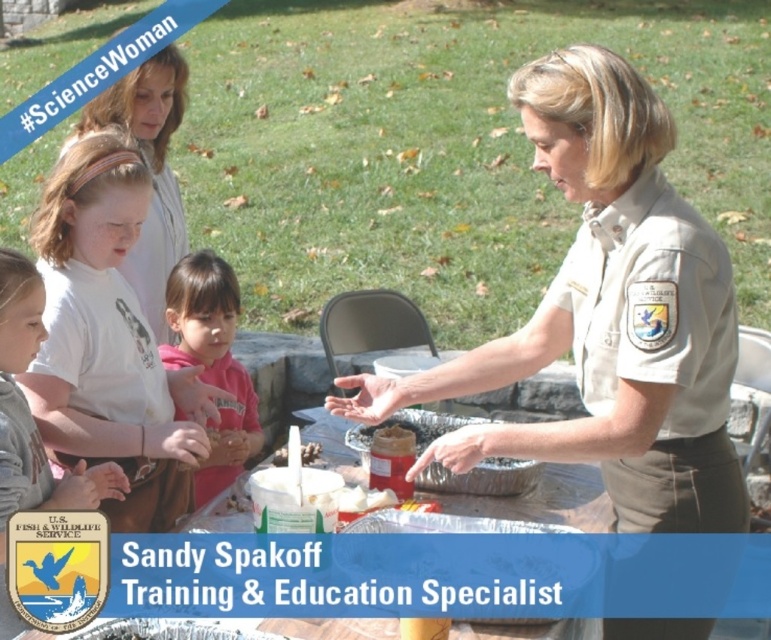
You are a photographer trying to capture a closeup of the two points in the image. From your current position, which point, point (628,131) or point (32,493), is nearer to you?

Point (628,131) is closer to the viewer than point (32,493), so the photographer should focus on that point first to capture it in a closeup.

Sandy Spakoff is demonstrating to a group of children. Which object is covering the other one, the satin tan uniform at center or the light brown hair at center?

The satin tan uniform at center is positioned over the light brown hair at center.

You are a photographer trying to capture a candid shot of the Training Specialist and the children. You notice two participants wearing a matte white shirt at lower left and a pink fleece hoodie at center. Which participant is positioned more to the left side of the scene?

The matte white shirt at lower left is positioned to the left of the pink fleece hoodie at center, so the participant wearing the matte white shirt at lower left is more to the left side of the scene.